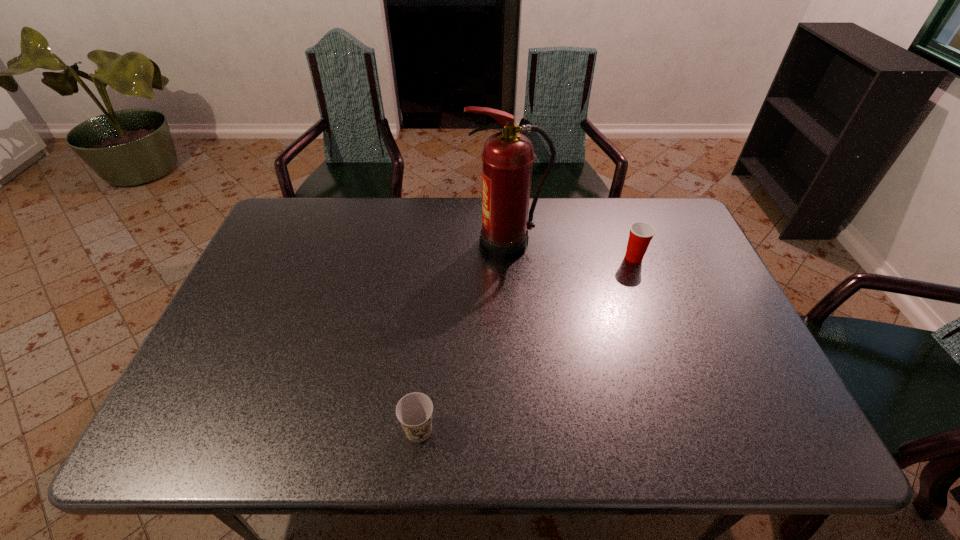
Identify the location of the tallest object. (507, 157).

The height and width of the screenshot is (540, 960). Find the location of `fire extinguisher`. fire extinguisher is located at coordinates (507, 157).

Find the location of a particular element. The width and height of the screenshot is (960, 540). the rightmost object is located at coordinates (641, 233).

You are a GUI agent. You are given a task and a screenshot of the screen. Output one action in this format:
    pyautogui.click(x=<x>, y=<y>)
    Task: Click on the farther Dixie cup
    
    Given the screenshot: What is the action you would take?
    (x=641, y=233)

I want to click on the shortest object, so click(x=414, y=411).

Locate an element on the screen. This screenshot has height=540, width=960. the nearer Dixie cup is located at coordinates (414, 411).

At what (x,y) coordinates should I click in order to perform the action: click on vacant space located on the front-facing side of the tallest object. Please return your answer as a coordinate pair (x, y). Looking at the image, I should click on (403, 244).

Find the location of a particular element. free space located 0.140m on the front-facing side of the tallest object is located at coordinates (422, 244).

Identify the location of vacant space located 0.060m on the front-facing side of the tallest object. The height and width of the screenshot is (540, 960). (448, 244).

Where is `free spot located on the front of the second shortest object`? The height and width of the screenshot is (540, 960). free spot located on the front of the second shortest object is located at coordinates (680, 383).